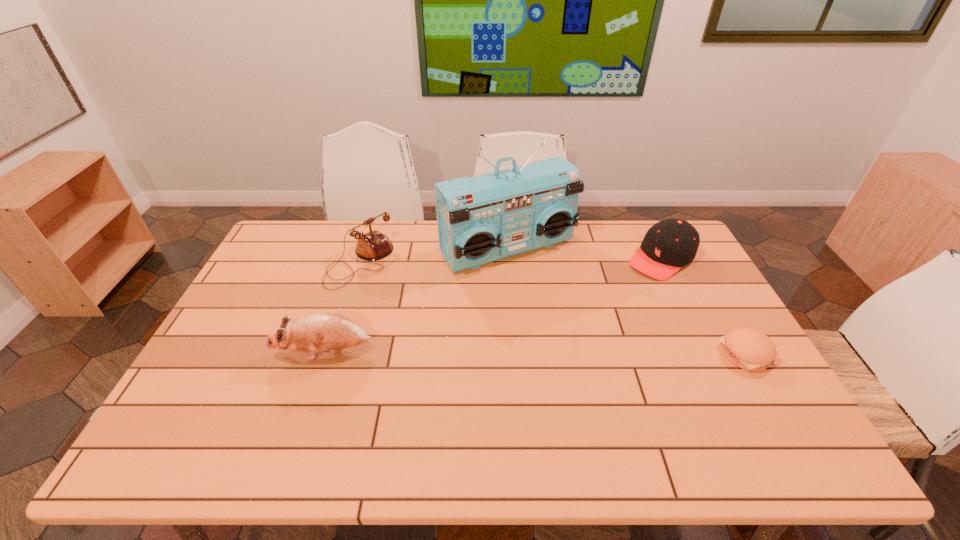
The width and height of the screenshot is (960, 540). What are the coordinates of `free space located 0.380m on the rotary dial of the telephone` in the screenshot? It's located at (462, 343).

Find the location of a particular element. The height and width of the screenshot is (540, 960). vacant space located on the rotary dial of the telephone is located at coordinates (423, 315).

The height and width of the screenshot is (540, 960). In order to click on vacant space located 0.090m on the front-facing side of the radio receiver in this screenshot , I will do `click(555, 294)`.

This screenshot has height=540, width=960. I want to click on vacant space positioned 0.300m on the front-facing side of the radio receiver, so click(594, 341).

What are the coordinates of `free space located 0.180m on the front-facing side of the radio receiver` in the screenshot? It's located at (570, 313).

Where is `free space located 0.400m on the front-facing side of the cap`? free space located 0.400m on the front-facing side of the cap is located at coordinates (568, 338).

Find the location of a particular element. This screenshot has width=960, height=540. free space located on the front-facing side of the cap is located at coordinates (612, 300).

The image size is (960, 540). Find the location of `vacant space located 0.270m on the front-facing side of the cap`. vacant space located 0.270m on the front-facing side of the cap is located at coordinates (595, 315).

Identify the location of telephone situated at the far edge. This screenshot has width=960, height=540. (372, 246).

This screenshot has height=540, width=960. Identify the location of radio receiver located at the far edge. (481, 219).